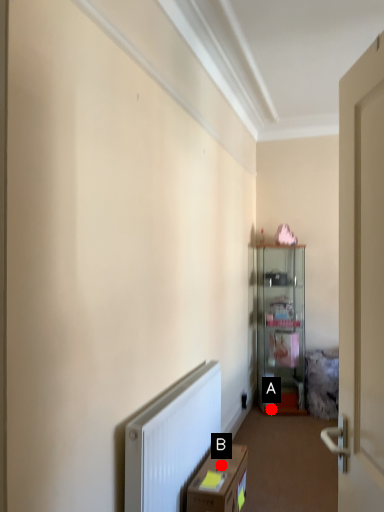
Question: Two points are circled on the image, labeled by A and B beside each circle. Which point is farther from the camera taking this photo?

Choices:
 (A) A is further
 (B) B is further

Answer: (A)